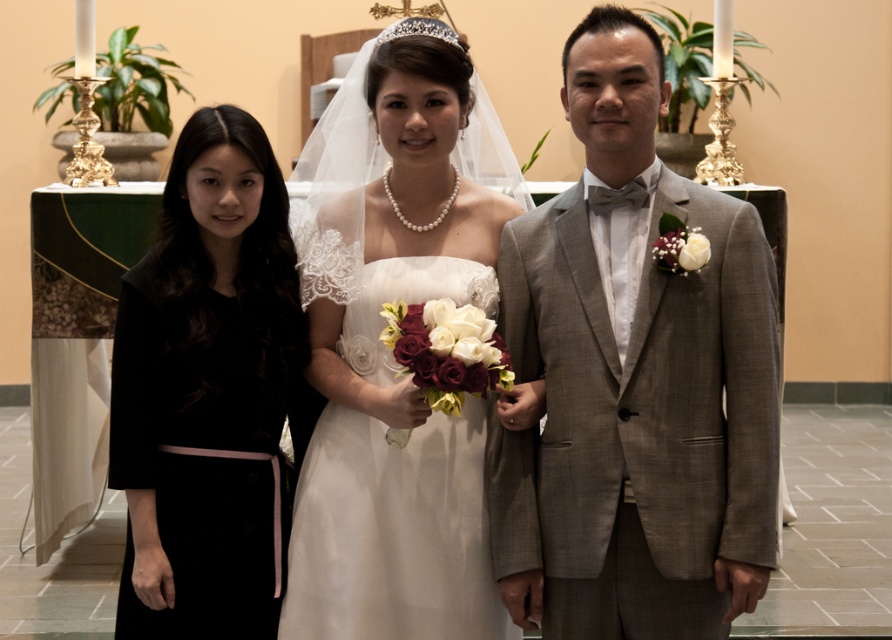
Is black satin dress at left closer to the viewer compared to silver metallic tiara at center?

Yes, black satin dress at left is closer to the viewer.

Who is lower down, black satin dress at left or silver metallic tiara at center?

black satin dress at left is lower down.

Between point (232, 259) and point (403, 35), which one is positioned in front?

Positioned in front is point (403, 35).

Identify the location of black satin dress at left. (209, 394).

Does white satin dress at center have a smaller size compared to silver metallic tiara at center?

Incorrect, white satin dress at center is not smaller in size than silver metallic tiara at center.

Is white satin dress at center bigger than silver metallic tiara at center?

Yes.

The width and height of the screenshot is (892, 640). What do you see at coordinates (392, 349) in the screenshot? I see `white satin dress at center` at bounding box center [392, 349].

At what (x,y) coordinates should I click in order to perform the action: click on white satin dress at center. Please return your answer as a coordinate pair (x, y). Looking at the image, I should click on 392,349.

Which of these two, gray textured suit at right or black satin dress at left, stands taller?

With more height is gray textured suit at right.

Image resolution: width=892 pixels, height=640 pixels. What do you see at coordinates (634, 380) in the screenshot?
I see `gray textured suit at right` at bounding box center [634, 380].

This screenshot has width=892, height=640. I want to click on gray textured suit at right, so click(634, 380).